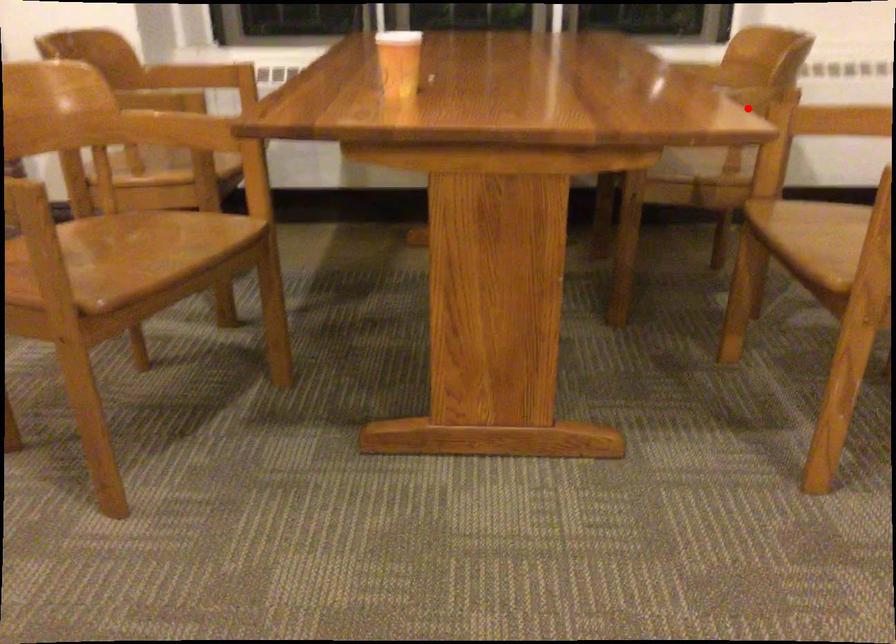
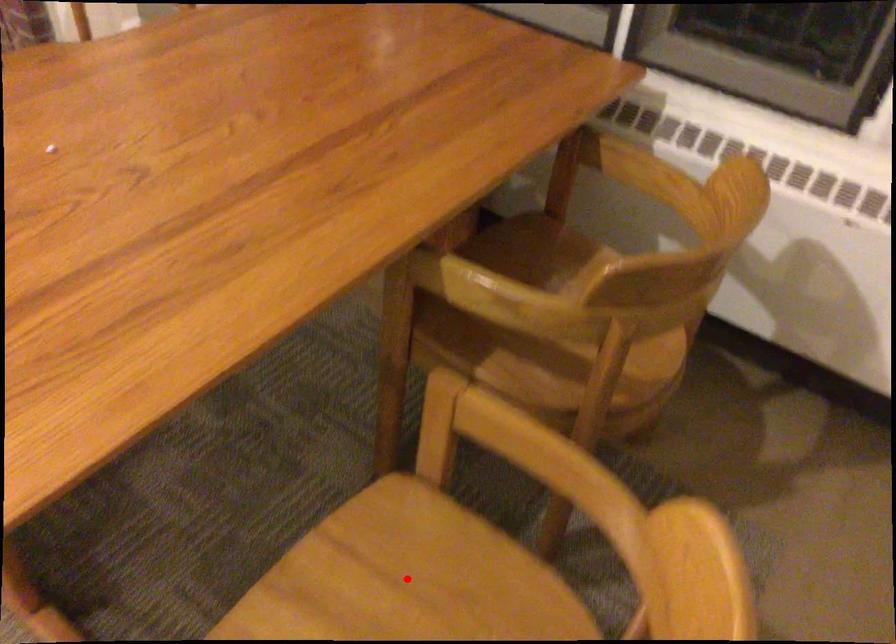
I am providing you with two images of the same scene from different viewpoints. A red point is marked on the first image and another point is marked on the second image. Does the point marked in image1 correspond to the same location as the one in image2?

No